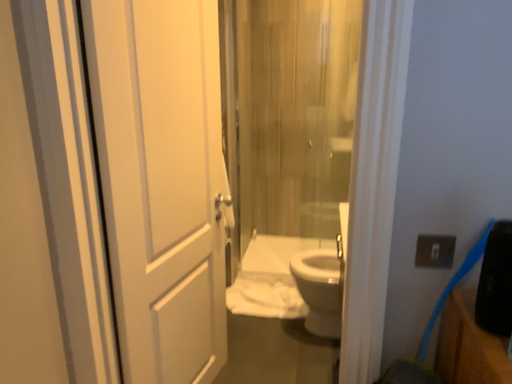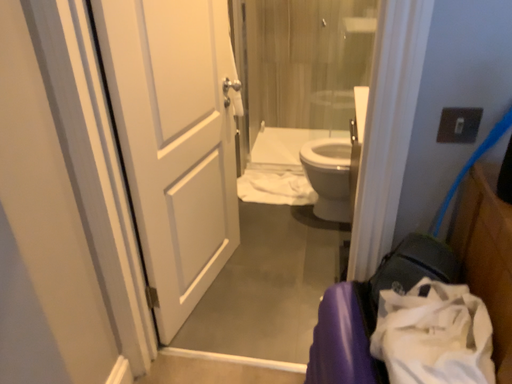
Question: How did the camera likely rotate when shooting the video?

Choices:
 (A) rotated upward
 (B) rotated downward

Answer: (B)